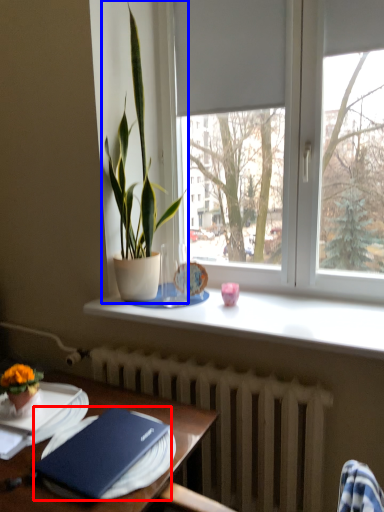
Question: Which of the following is the farthest to the observer, hardback book (highlighted by a red box) or houseplant (highlighted by a blue box)?

Choices:
 (A) hardback book
 (B) houseplant

Answer: (B)